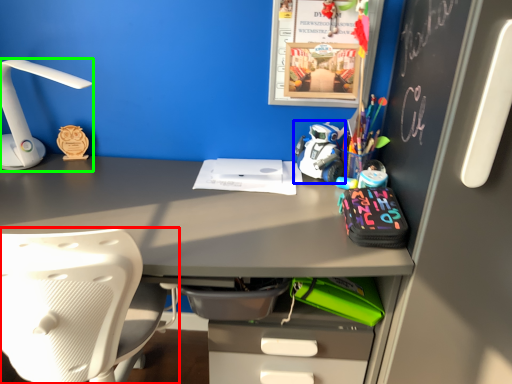
Question: Based on their relative distances, which object is nearer to chair (highlighted by a red box)? Choose from toy (highlighted by a blue box) and lamp (highlighted by a green box).

Choices:
 (A) toy
 (B) lamp

Answer: (B)